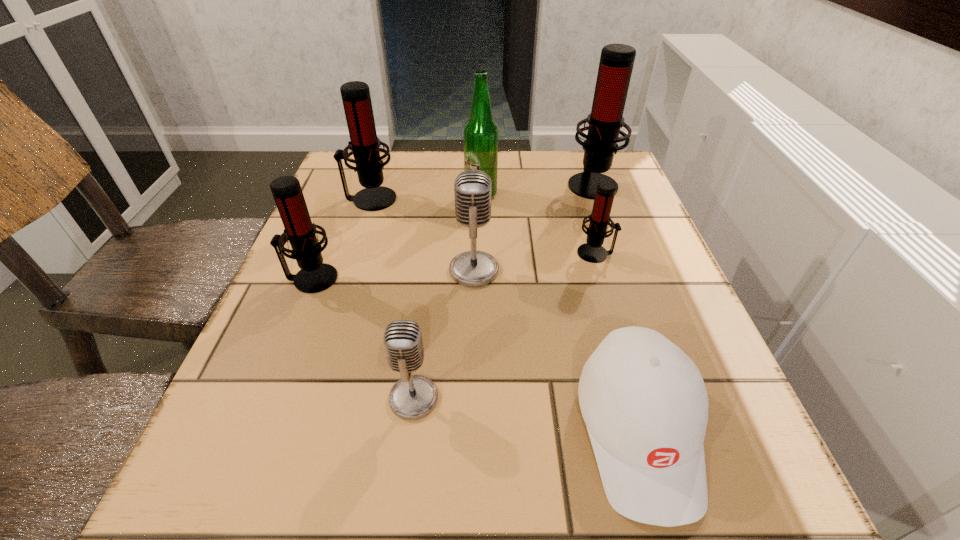
You are a GUI agent. You are given a task and a screenshot of the screen. Output one action in this format:
    pyautogui.click(x=<x>, y=<y>)
    Task: Click on the red microphone that stands as the second closest to the second nearest red microphone
    The image size is (960, 540).
    Given the screenshot: What is the action you would take?
    pyautogui.click(x=364, y=144)

Select which red microphone is the third closest to the nearest red microphone. Please provide its 2D coordinates. Your answer should be formatted as a tuple, i.e. [(x, y)], where the tuple contains the x and y coordinates of a point satisfying the conditions above.

[(616, 63)]

Locate an element on the screen. The height and width of the screenshot is (540, 960). vacant position in the image that satisfies the following two spatial constraints: 1. on the back side of the biggest red microphone; 2. on the right side of the right gray microphone is located at coordinates 475,184.